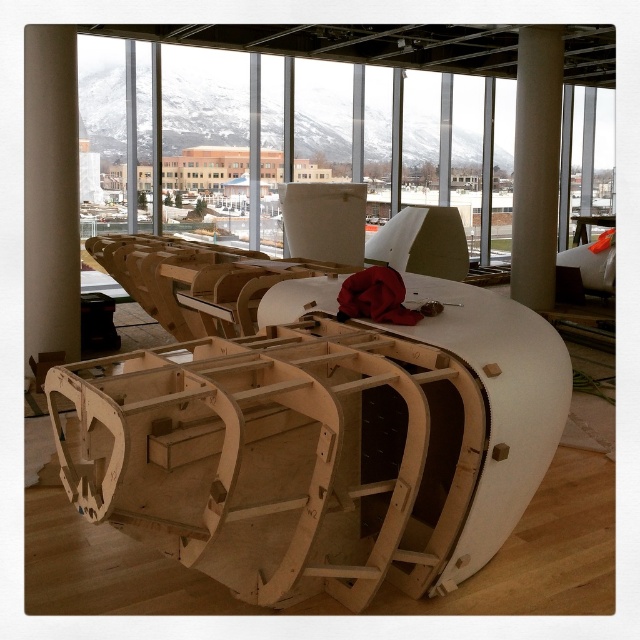
Question: Which point is closer to the camera?

Choices:
 (A) beige smooth pillar at left
 (B) natural wood boat at center

Answer: (B)

Question: Can you confirm if natural wood boat at center is positioned to the right of beige smooth pillar at left?

Choices:
 (A) yes
 (B) no

Answer: (A)

Question: Which point is farther from the camera taking this photo?

Choices:
 (A) (74, 385)
 (B) (547, 179)

Answer: (B)

Question: Which is nearer to the natural wood boat at center?

Choices:
 (A) beige smooth pillar at left
 (B) white smooth column at center

Answer: (A)

Question: Can you confirm if beige smooth pillar at left is wider than white smooth column at center?

Choices:
 (A) no
 (B) yes

Answer: (A)

Question: Does beige smooth pillar at left have a greater width compared to white smooth column at center?

Choices:
 (A) yes
 (B) no

Answer: (B)